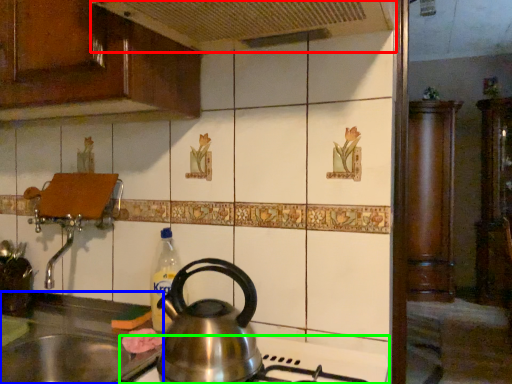
Question: Which object is positioned farthest from exhaust hood (highlighted by a red box)? Select from sink (highlighted by a blue box) and gas stove (highlighted by a green box).

Choices:
 (A) sink
 (B) gas stove

Answer: (A)